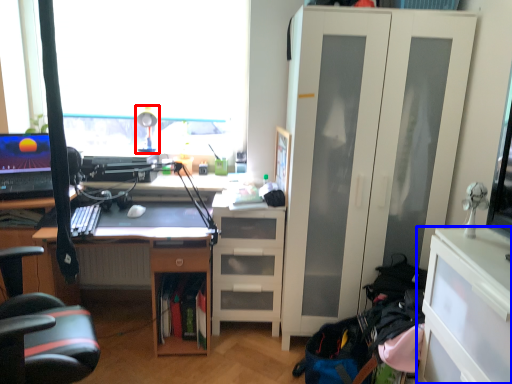
Question: Which object is closer to the camera taking this photo, table lamp (highlighted by a red box) or cabinetry (highlighted by a blue box)?

Choices:
 (A) table lamp
 (B) cabinetry

Answer: (B)